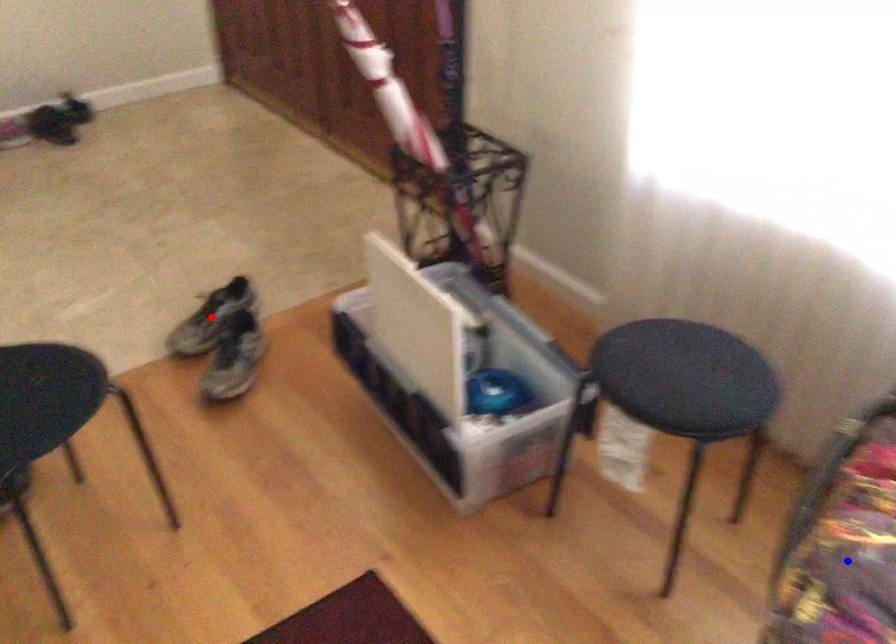
Question: Two points are marked on the image. Which point is closer to the camera?

Choices:
 (A) Blue point is closer.
 (B) Red point is closer.

Answer: (A)